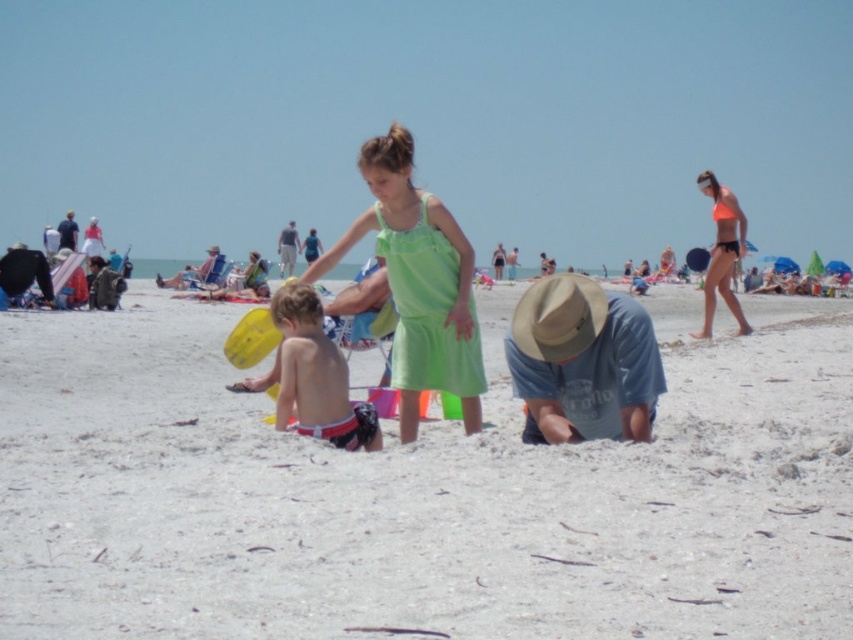
You are a photographer at the beach scene described. You want to capture a photo that includes both the denim blue shirt at center and the light blue denim shorts at center. Based on their positions, which one should be placed lower in the frame to ensure both are fully visible?

The denim blue shirt at center is located below light blue denim shorts at center, so to ensure both are fully visible in the photo, the denim blue shirt at center should be placed lower in the frame.

You are a photographer at the beach scene. You need to capture a photo where both the neon orange bikini at right and the light blue denim shorts at center are clearly visible. Which object should you focus on to ensure both are in frame without needing to adjust your camera angle?

You should focus on the neon orange bikini at right because it is larger than the light blue denim shorts at center, making it easier to ensure both are in frame without adjusting the camera angle.